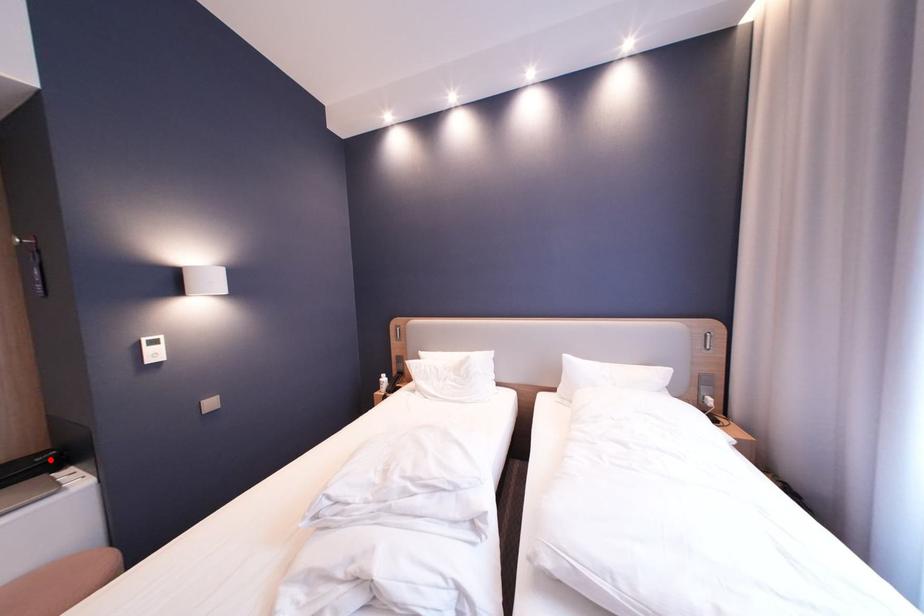
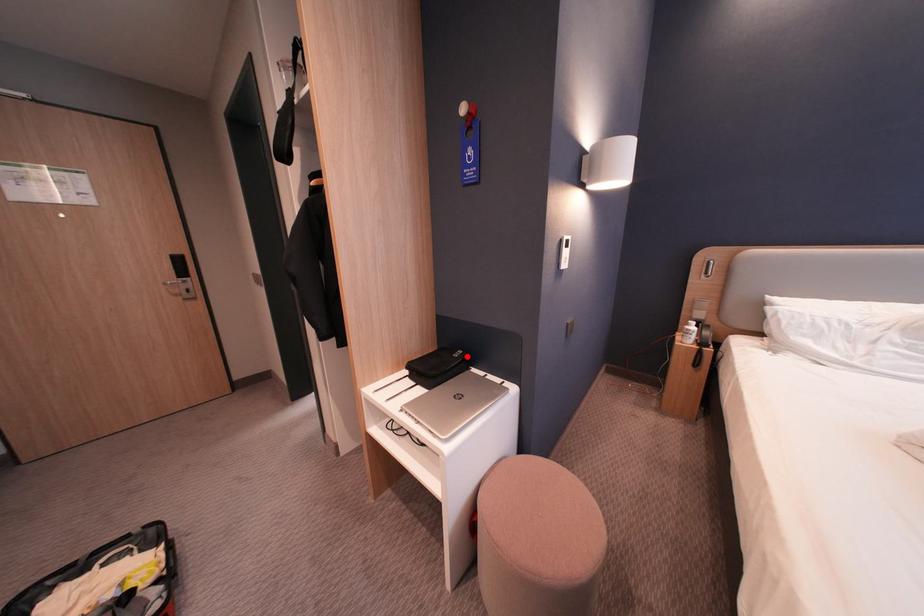
I am providing you with two images of the same scene from different viewpoints. A red point is marked on the first image and another point is marked on the second image. Does the point marked in image1 correspond to the same location as the one in image2?

Yes